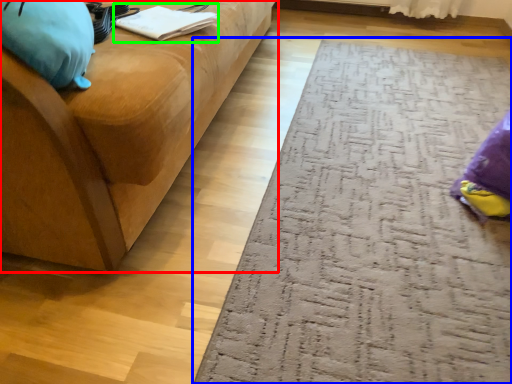
Question: Which object is positioned farthest from studio couch (highlighted by a red box)? Select from doormat (highlighted by a blue box) and book (highlighted by a green box).

Choices:
 (A) doormat
 (B) book

Answer: (A)